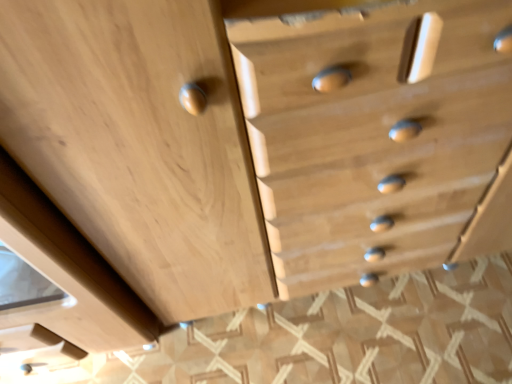
What do you see at coordinates (139, 145) in the screenshot? This screenshot has height=384, width=512. I see `natural wood drawer at center` at bounding box center [139, 145].

Locate an element on the screen. natural wood drawer at center is located at coordinates (139, 145).

Looking at this image, measure the distance between point (45,150) and camera.

The depth of point (45,150) is 24.02 inches.

I want to click on natural wood drawer at center, so (139, 145).